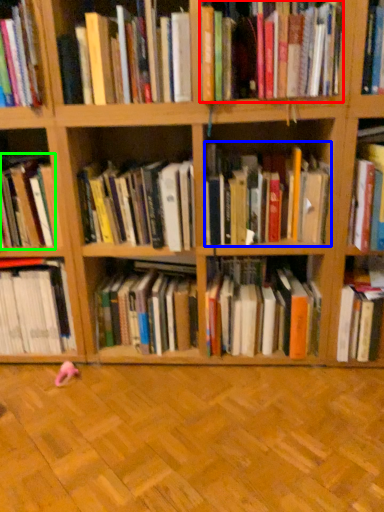
Question: Which object is positioned farthest from book (highlighted by a red box)? Select from book (highlighted by a blue box) and book (highlighted by a green box).

Choices:
 (A) book
 (B) book

Answer: (B)